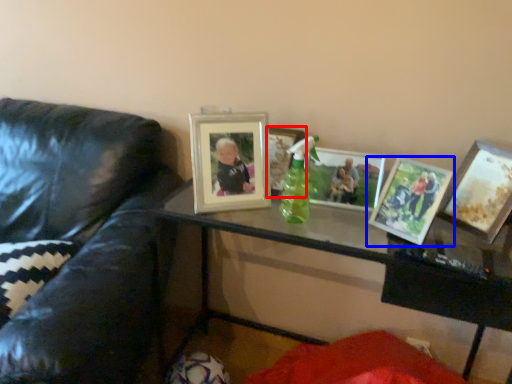
Question: Which object is further to the camera taking this photo, picture frame (highlighted by a red box) or picture frame (highlighted by a blue box)?

Choices:
 (A) picture frame
 (B) picture frame

Answer: (A)